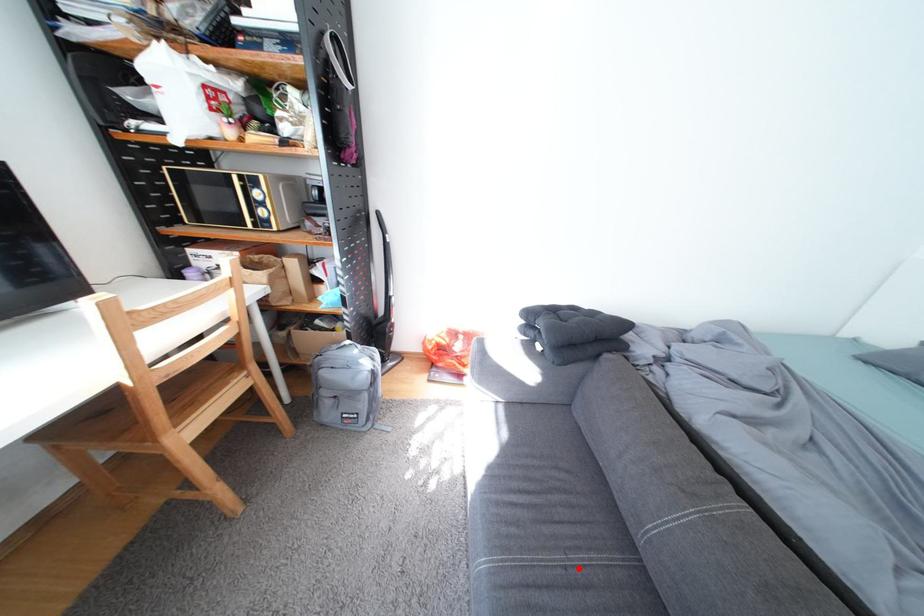
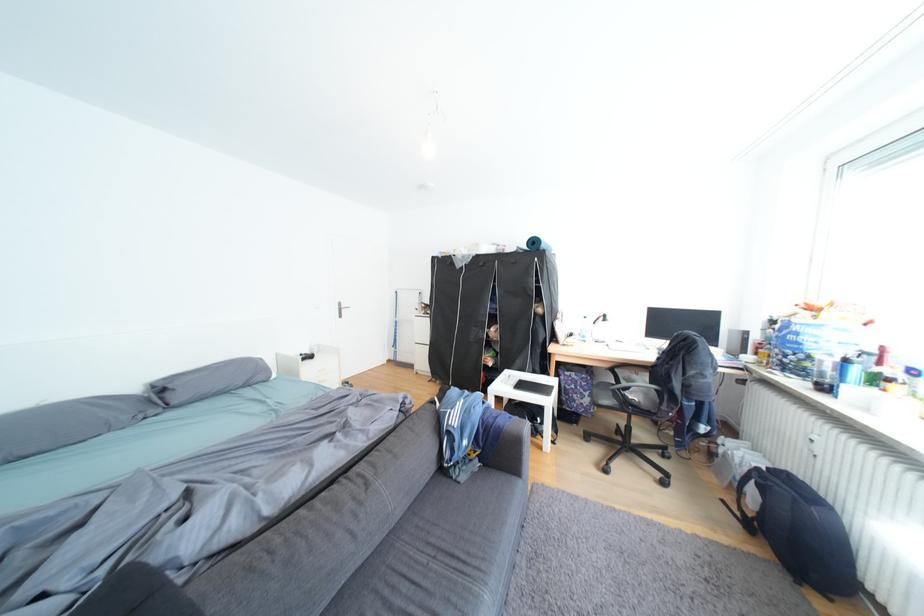
Find the pixel in the second image that matches the highlighted location in the first image.

(447, 559)